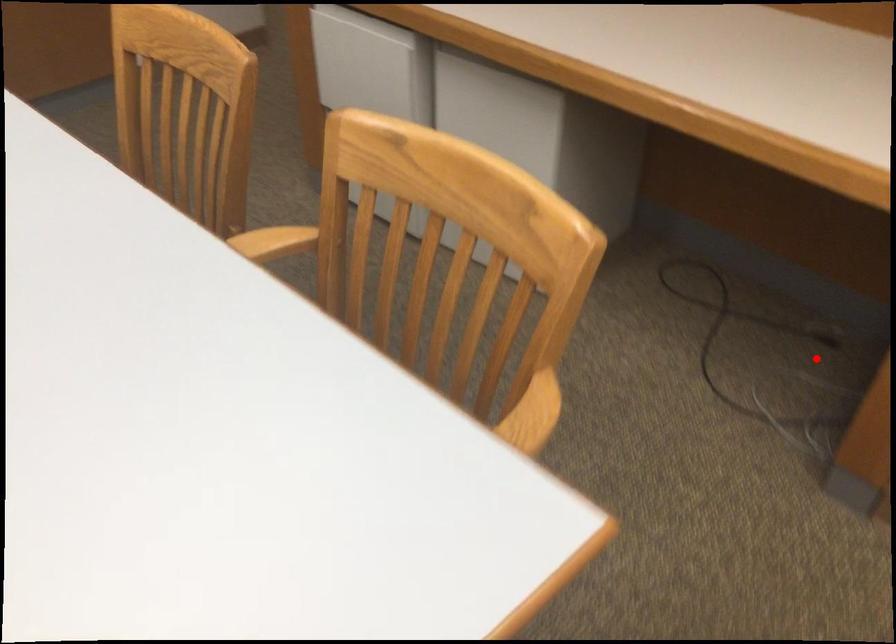
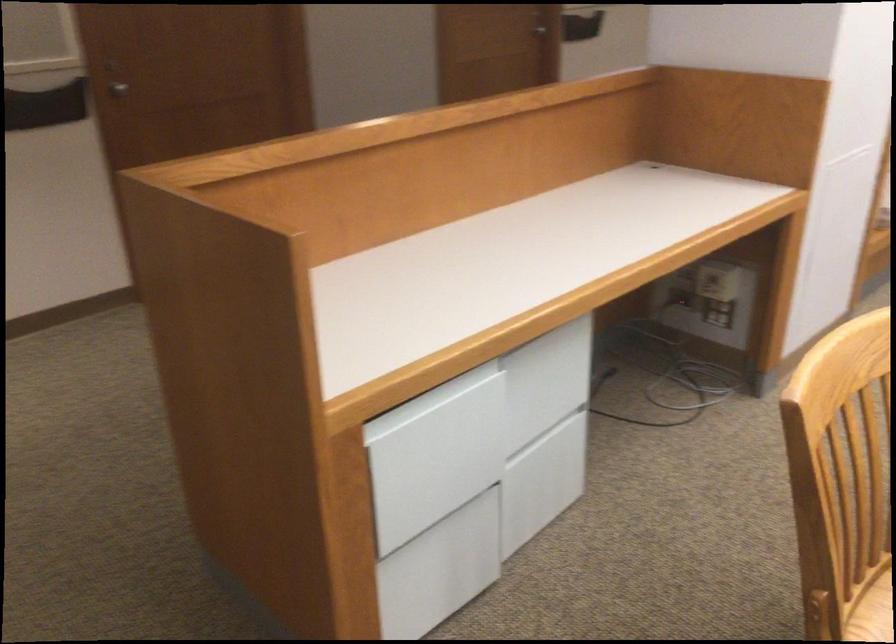
Locate, in the second image, the point that corresponds to the highlighted location in the first image.

(653, 371)